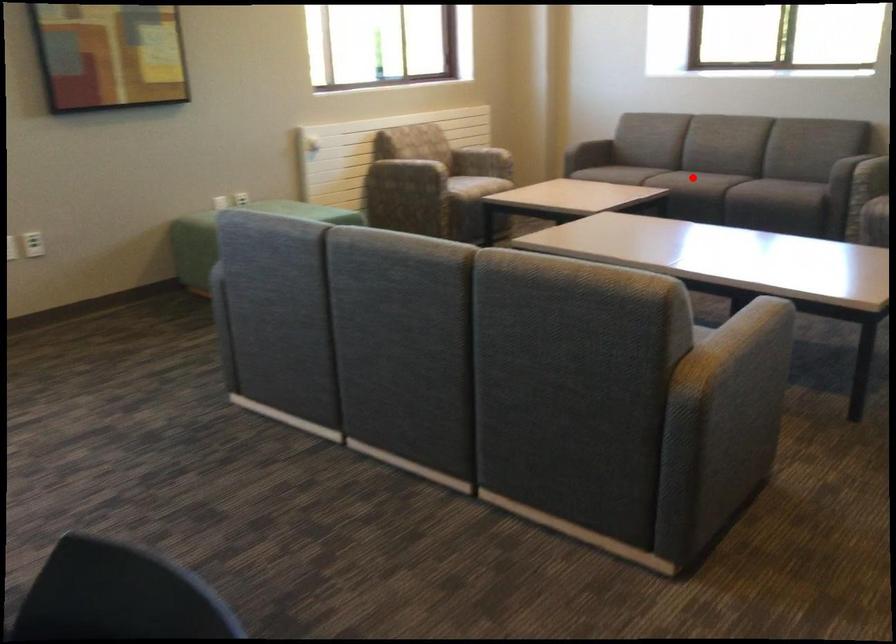
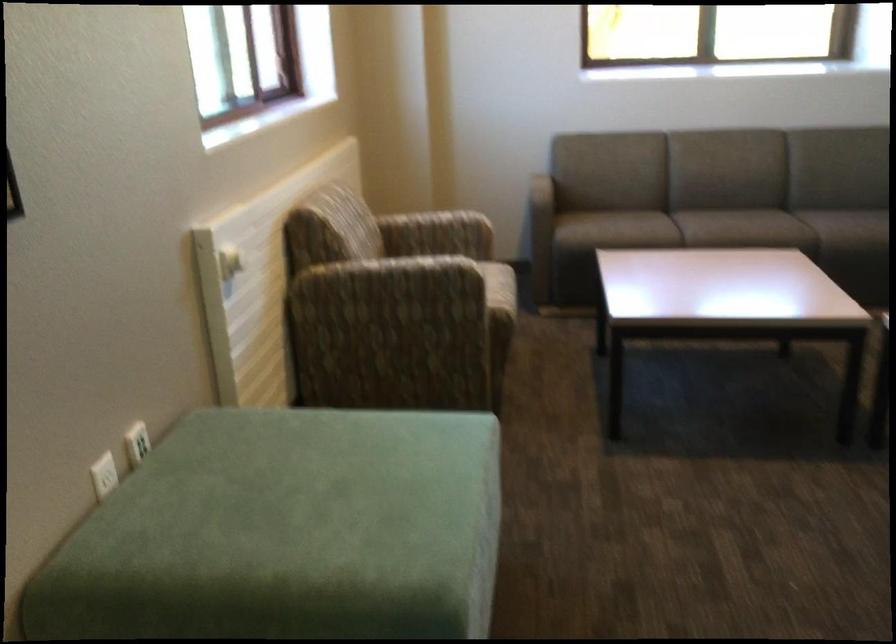
The point at the highlighted location is marked in the first image. Where is the corresponding point in the second image?

(780, 229)